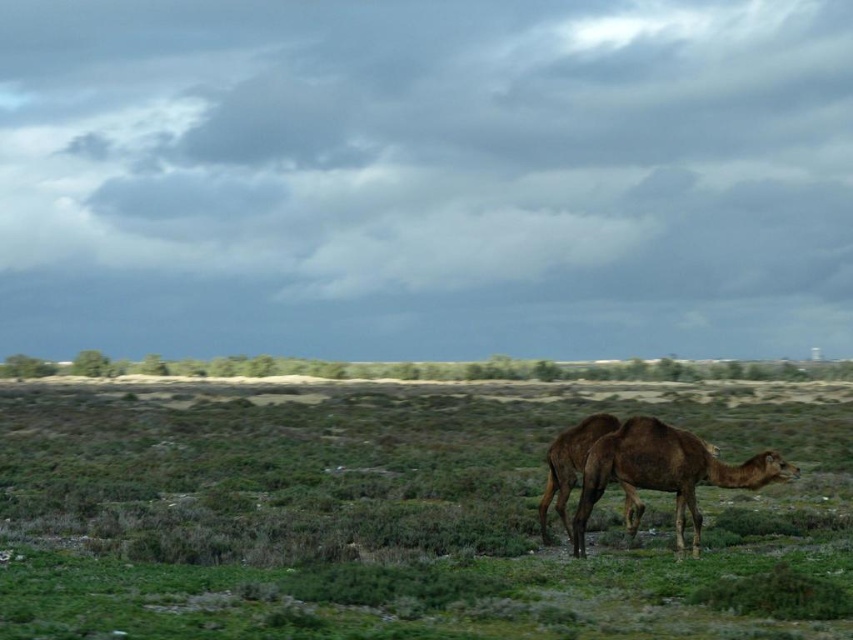
You are standing at the point with coordinates (402, 515) in the image. What do you see directly beneath your feet?

You see green grassy at center directly beneath your feet at point (402, 515).

You are a traveler in this landscape and want to find the tallest vegetation. Which object between the green grassy at center and brown matte camel at lower right should you look for?

The green grassy at center has a greater height compared to the brown matte camel at lower right, so you should look for the green grassy at center as the tallest vegetation.

You are a traveler in this landscape and need to find the green grassy area to rest your camels. According to the coordinates provided, where exactly is the green grassy at center located?

The green grassy at center is located at point (402, 515).